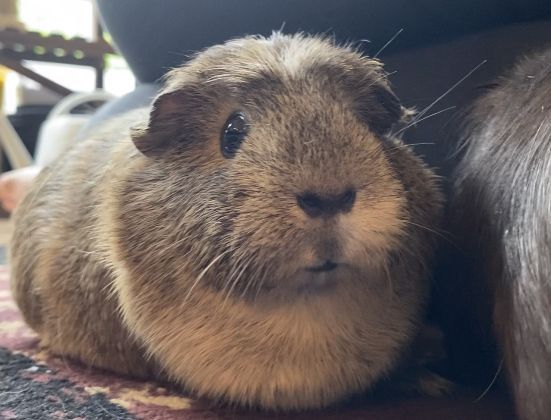
You are a GUI agent. You are given a task and a screenshot of the screen. Output one action in this format:
    pyautogui.click(x=<x>, y=<y>)
    Task: Click on the bright white light
    The width and height of the screenshot is (551, 420).
    Given the screenshot: What is the action you would take?
    pyautogui.click(x=64, y=18), pyautogui.click(x=77, y=79), pyautogui.click(x=116, y=78)